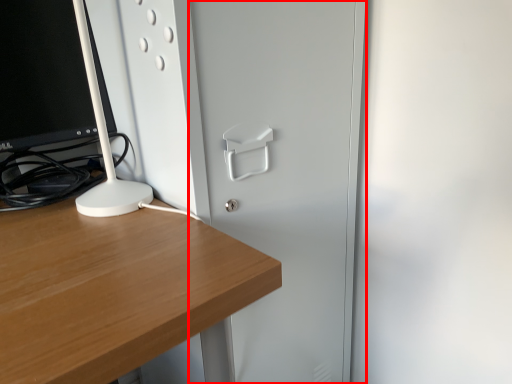
Question: From the image's perspective, considering the relative positions of glass door (annotated by the red box) and computer monitor in the image provided, where is glass door (annotated by the red box) located with respect to the staircase?

Choices:
 (A) above
 (B) below

Answer: (B)